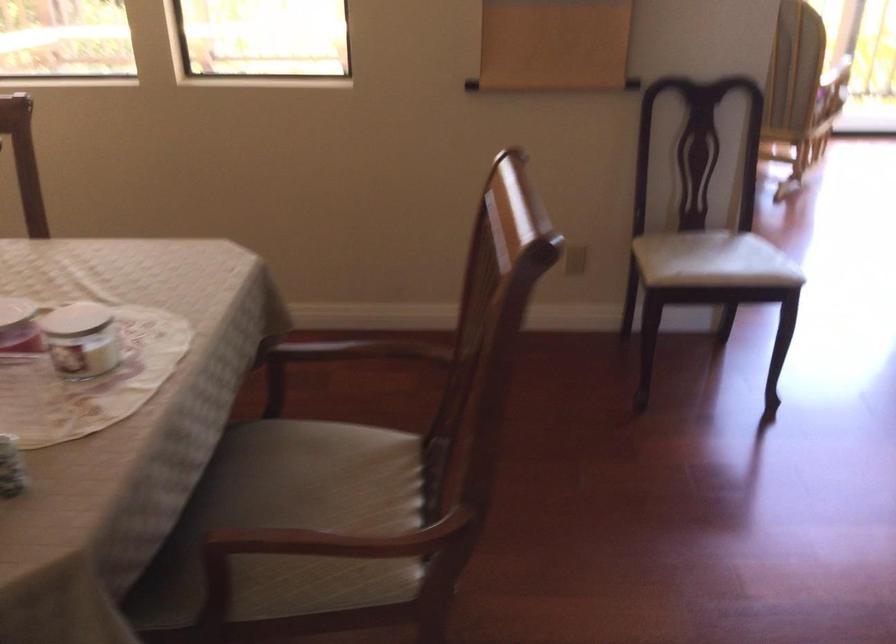
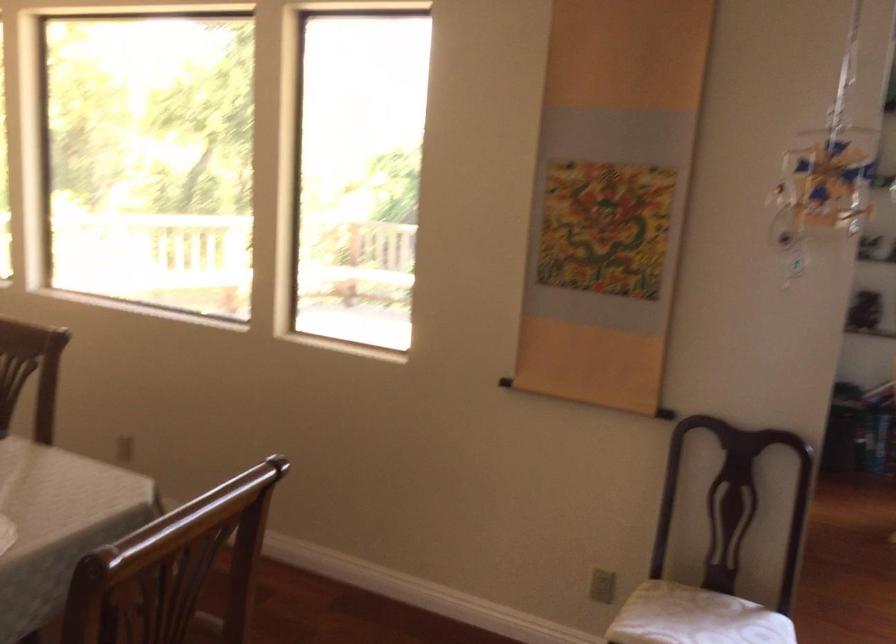
First-person continuous shooting, in which direction is the camera rotating?

The camera's rotation is toward left-up.